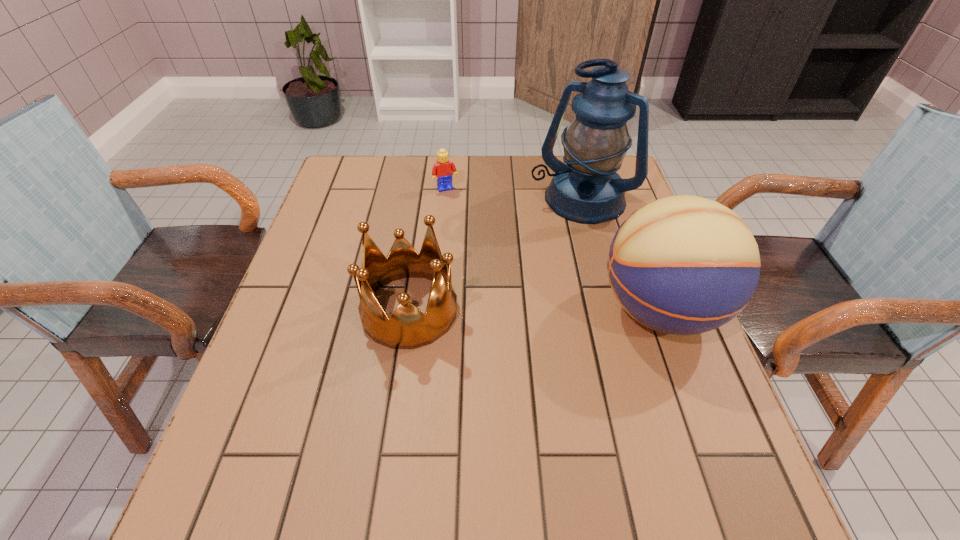
At what (x,y) coordinates should I click in order to perform the action: click on vacant position in the image that satisfies the following two spatial constraints: 1. on the back side of the crown; 2. on the right side of the tallest object. Please return your answer as a coordinate pair (x, y). This screenshot has width=960, height=540. Looking at the image, I should click on (425, 199).

The width and height of the screenshot is (960, 540). In order to click on vacant region that satisfies the following two spatial constraints: 1. on the front side of the basketball; 2. on the patterned surface of the crown in this screenshot , I will do `click(409, 310)`.

This screenshot has height=540, width=960. I want to click on vacant space that satisfies the following two spatial constraints: 1. on the front side of the Lego; 2. on the patterned surface of the basketball, so click(435, 310).

I want to click on free space that satisfies the following two spatial constraints: 1. on the front side of the second tallest object; 2. on the patterned surface of the tallest object, so click(x=609, y=310).